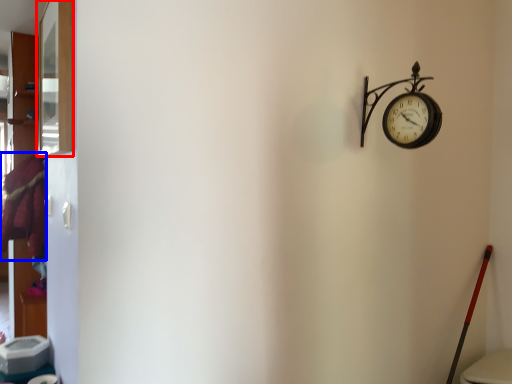
Question: Among these objects, which one is nearest to the camera, window (highlighted by a red box) or laundry (highlighted by a blue box)?

Choices:
 (A) window
 (B) laundry

Answer: (A)